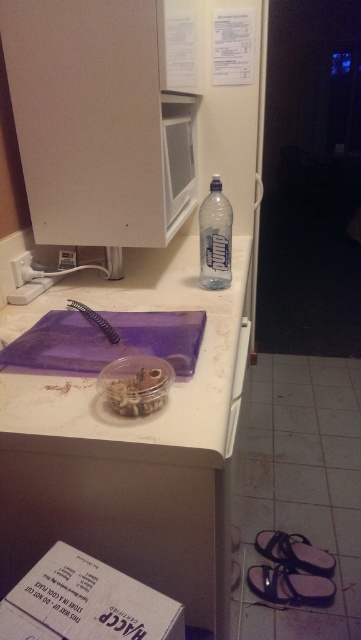
Is translucent plastic jar at center bigger than white plastic drawer at lower center?

Correct, translucent plastic jar at center is larger in size than white plastic drawer at lower center.

Can you confirm if translucent plastic jar at center is shorter than white plastic drawer at lower center?

Incorrect, translucent plastic jar at center's height does not fall short of white plastic drawer at lower center's.

Is point (118, 397) closer to camera compared to point (236, 422)?

Yes, point (118, 397) is in front of point (236, 422).

Find the location of a particular element. This screenshot has height=640, width=361. translucent plastic jar at center is located at coordinates (137, 390).

Does transparent plastic bottle at center appear on the left side of translucent plastic jar at center?

In fact, transparent plastic bottle at center is to the right of translucent plastic jar at center.

Can you confirm if transparent plastic bottle at center is smaller than translucent plastic jar at center?

Incorrect, transparent plastic bottle at center is not smaller in size than translucent plastic jar at center.

Is point (210, 269) behind point (123, 410)?

Yes, point (210, 269) is farther from viewer.

This screenshot has width=361, height=640. In order to click on transparent plastic bottle at center in this screenshot , I will do `click(215, 237)`.

Consider the image. Does white matte cutting board at center come in front of white plastic drawer at lower center?

Yes.

Can you confirm if white matte cutting board at center is shorter than white plastic drawer at lower center?

No.

Locate an element on the screen. white matte cutting board at center is located at coordinates (171, 387).